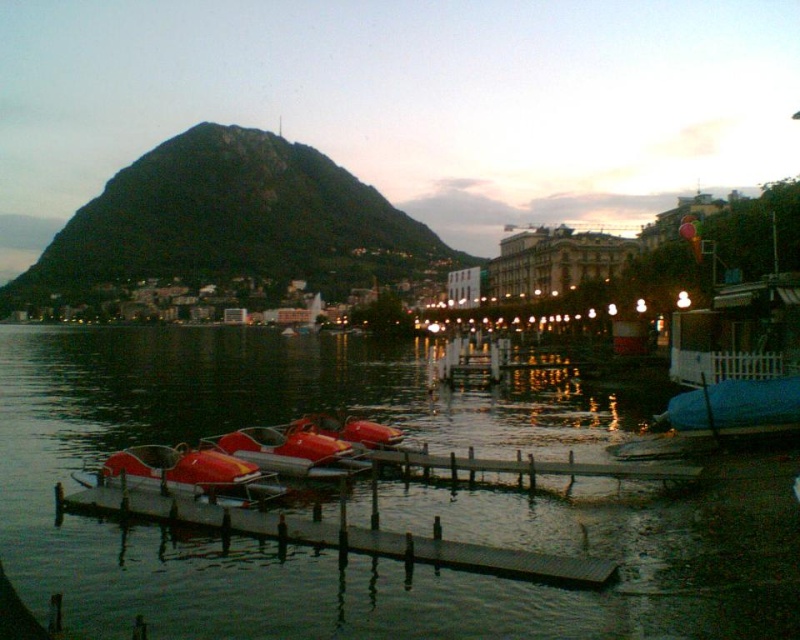
Does gray wooden dock at center appear over metallic red paddle boat at center?

Actually, gray wooden dock at center is below metallic red paddle boat at center.

Does gray wooden dock at center have a greater height compared to metallic red paddle boat at center?

In fact, gray wooden dock at center may be shorter than metallic red paddle boat at center.

Is point (392, 460) positioned before point (348, 445)?

No, (392, 460) is further to viewer.

Find the location of a particular element. Image resolution: width=800 pixels, height=640 pixels. gray wooden dock at center is located at coordinates (521, 470).

Is metallic red paddle boat at center taller than red rubber boat at center?

Correct, metallic red paddle boat at center is much taller as red rubber boat at center.

Does metallic red paddle boat at center appear on the left side of red rubber boat at center?

Indeed, metallic red paddle boat at center is positioned on the left side of red rubber boat at center.

Where is `metallic red paddle boat at center`? metallic red paddle boat at center is located at coordinates (292, 451).

Where is `metallic red paddle boat at center`? metallic red paddle boat at center is located at coordinates (292, 451).

Is gray wooden dock at center above red rubber boat at center?

No, gray wooden dock at center is not above red rubber boat at center.

Is gray wooden dock at center to the left of red rubber boat at center from the viewer's perspective?

No, gray wooden dock at center is not to the left of red rubber boat at center.

Which is in front, point (686, 481) or point (332, 412)?

Point (686, 481) is in front.

Find the location of a particular element. This screenshot has width=800, height=640. gray wooden dock at center is located at coordinates (521, 470).